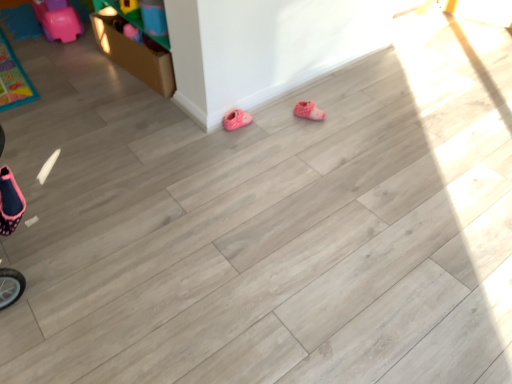
Question: Is pink polka dot fabric booties at center, the first footwear from the right, to the left or to the right of pink fabric slipper at lower center, the 1th footwear from the left, in the image?

Choices:
 (A) left
 (B) right

Answer: (B)

Question: Is pink polka dot fabric booties at center, positioned as the second footwear in left-to-right order, wider or thinner than pink fabric slipper at lower center, the 1th footwear from the left?

Choices:
 (A) thin
 (B) wide

Answer: (B)

Question: Considering the positions of pink polka dot fabric booties at center, the first footwear from the right, and pink fabric slipper at lower center, which ranks as the second footwear in right-to-left order, in the image, is pink polka dot fabric booties at center, the first footwear from the right, taller or shorter than pink fabric slipper at lower center, which ranks as the second footwear in right-to-left order,?

Choices:
 (A) tall
 (B) short

Answer: (B)

Question: Is point (224, 125) closer or farther from the camera than point (309, 107)?

Choices:
 (A) farther
 (B) closer

Answer: (B)

Question: Would you say pink fabric slipper at lower center, which ranks as the second footwear in right-to-left order, is to the left or to the right of pink polka dot fabric booties at center, the first footwear from the right, in the picture?

Choices:
 (A) right
 (B) left

Answer: (B)

Question: In terms of width, does pink fabric slipper at lower center, the 1th footwear from the left, look wider or thinner when compared to pink polka dot fabric booties at center, positioned as the second footwear in left-to-right order?

Choices:
 (A) wide
 (B) thin

Answer: (B)

Question: Considering the positions of pink fabric slipper at lower center, the 1th footwear from the left, and pink polka dot fabric booties at center, the first footwear from the right, in the image, is pink fabric slipper at lower center, the 1th footwear from the left, bigger or smaller than pink polka dot fabric booties at center, the first footwear from the right,?

Choices:
 (A) big
 (B) small

Answer: (A)